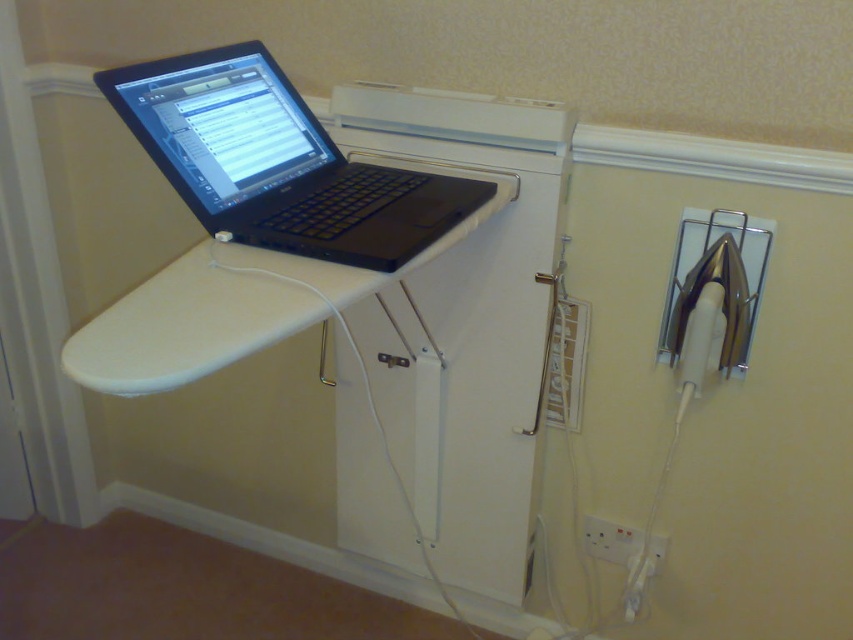
You are setting up a temporary workspace in a laundry room. You have a black matte laptop at upper left and a white plastic electric outlet at lower center. Which object is taller in the image?

The black matte laptop at upper left is much taller than the white plastic electric outlet at lower center.

You need to connect a charger to the black matte laptop at upper left and the white plastic electric outlet at lower center. Which one has a larger width?

The black matte laptop at upper left has a larger width than the white plastic electric outlet at lower center.